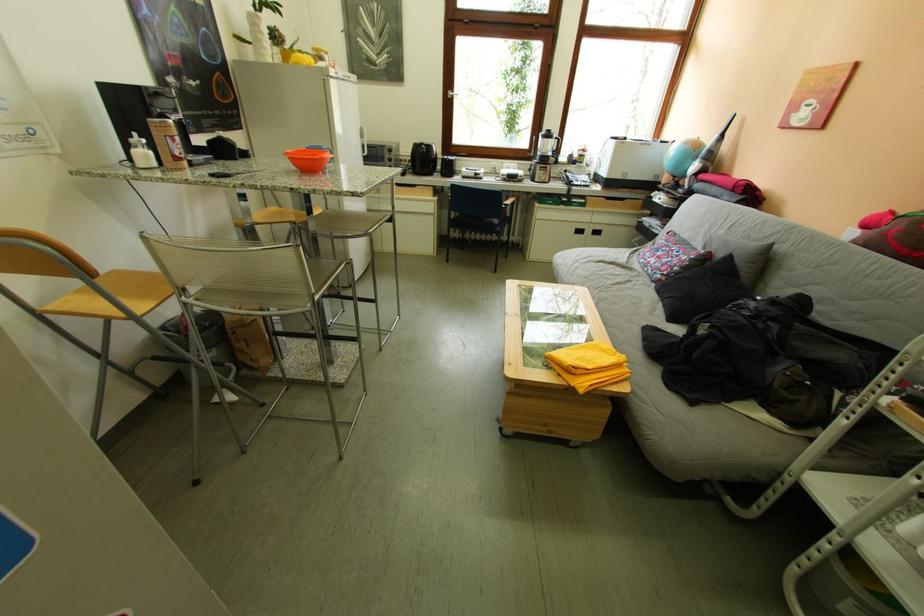
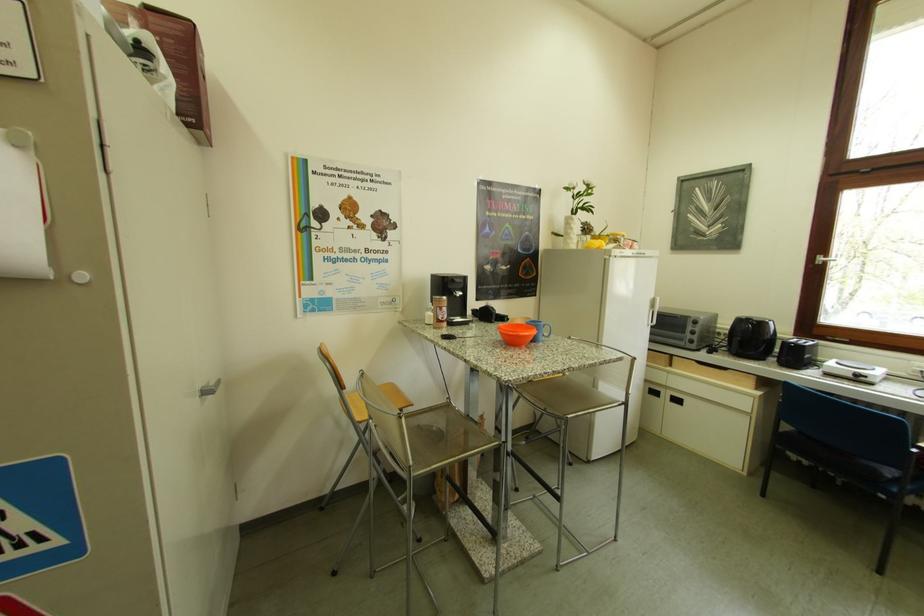
Question: The camera is either moving clockwise (left) or counter-clockwise (right) around the object. The first image is from the beginning of the video and the second image is from the end. Is the camera moving left or right when shooting the video?

Choices:
 (A) Left
 (B) Right

Answer: (B)